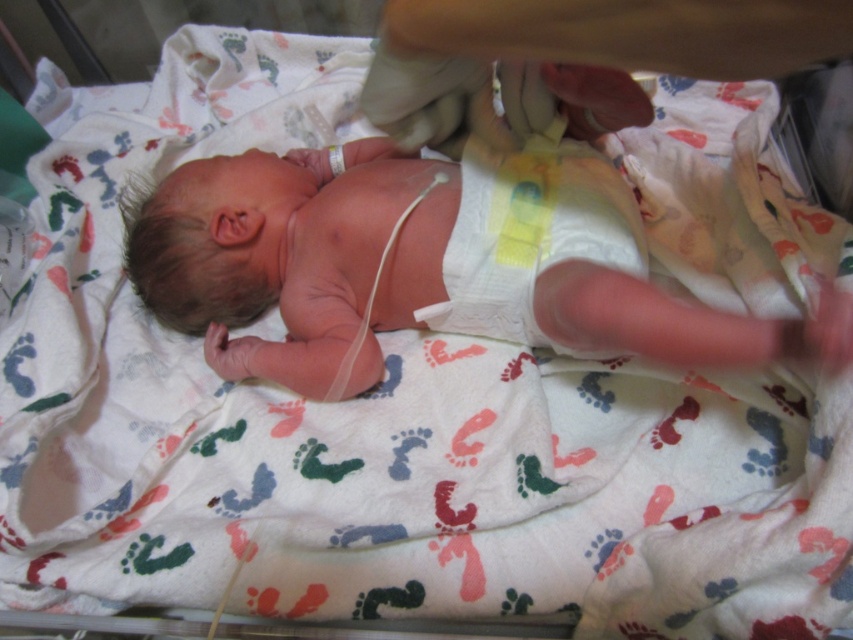
Question: Which object appears farthest from the camera in this image?

Choices:
 (A) white paper diaper at center
 (B) smooth skin newborn at center

Answer: (A)

Question: Which object appears closest to the camera in this image?

Choices:
 (A) smooth skin newborn at center
 (B) white paper diaper at center

Answer: (A)

Question: Can you confirm if smooth skin newborn at center is positioned to the right of white paper diaper at center?

Choices:
 (A) yes
 (B) no

Answer: (B)

Question: Is smooth skin newborn at center to the right of white paper diaper at center from the viewer's perspective?

Choices:
 (A) yes
 (B) no

Answer: (B)

Question: Can you confirm if smooth skin newborn at center is wider than white paper diaper at center?

Choices:
 (A) yes
 (B) no

Answer: (A)